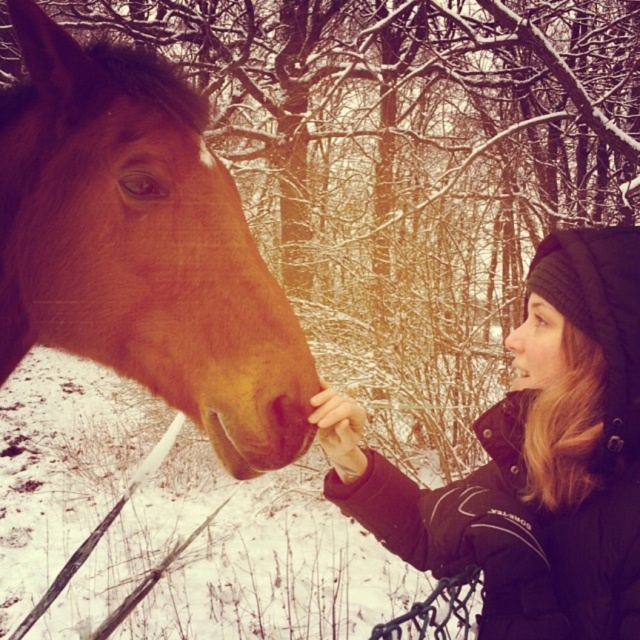
Question: Considering the real-world distances, which object is farthest from the smooth skin nose at center?

Choices:
 (A) black woolen beanie at upper right
 (B) brown matte horse at left

Answer: (B)

Question: Can you confirm if brown matte horse at left is positioned to the left of smooth skin nose at center?

Choices:
 (A) no
 (B) yes

Answer: (B)

Question: Is brown matte horse at left wider than black woolen beanie at upper right?

Choices:
 (A) no
 (B) yes

Answer: (B)

Question: Can you confirm if brown matte horse at left is thinner than black woolen beanie at upper right?

Choices:
 (A) yes
 (B) no

Answer: (B)

Question: Among these objects, which one is farthest from the camera?

Choices:
 (A) black woolen beanie at upper right
 (B) brown matte horse at left
 (C) smooth skin nose at center

Answer: (C)

Question: Which object is positioned closest to the brown matte horse at left?

Choices:
 (A) smooth skin nose at center
 (B) black woolen beanie at upper right

Answer: (B)